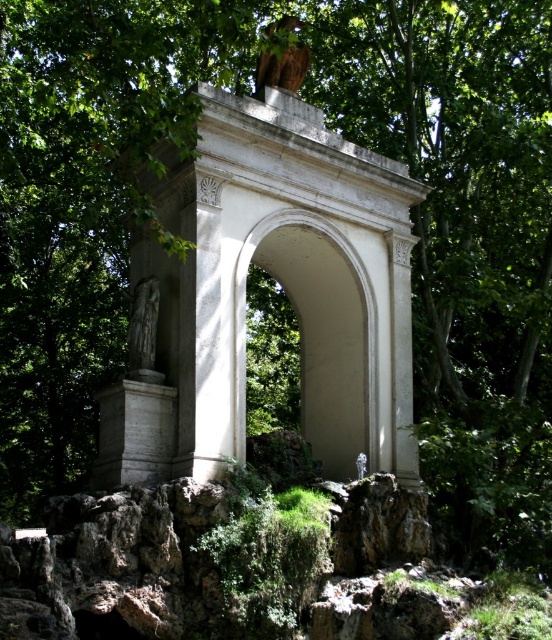
Is gray stone statue at center positioned at the back of wooden birdhouse at upper center?

That is True.

Can you confirm if gray stone statue at center is positioned to the right of wooden birdhouse at upper center?

Incorrect, gray stone statue at center is not on the right side of wooden birdhouse at upper center.

This screenshot has width=552, height=640. I want to click on gray stone statue at center, so click(x=144, y=332).

I want to click on gray stone statue at center, so click(144, 332).

Does white stone archway at center come in front of wooden birdhouse at upper center?

No.

Does white stone archway at center appear on the left side of wooden birdhouse at upper center?

Incorrect, white stone archway at center is not on the left side of wooden birdhouse at upper center.

Who is more forward, (x=325, y=310) or (x=296, y=17)?

Point (x=325, y=310) is in front.

Locate an element on the screen. This screenshot has width=552, height=640. white stone archway at center is located at coordinates (317, 333).

Does white stone archway at center appear over gray stone statue at center?

No.

Does white stone archway at center have a lesser height compared to gray stone statue at center?

Incorrect, white stone archway at center's height does not fall short of gray stone statue at center's.

Does point (374, 381) lie in front of point (141, 339)?

No.

Locate an element on the screen. white stone archway at center is located at coordinates (317, 333).